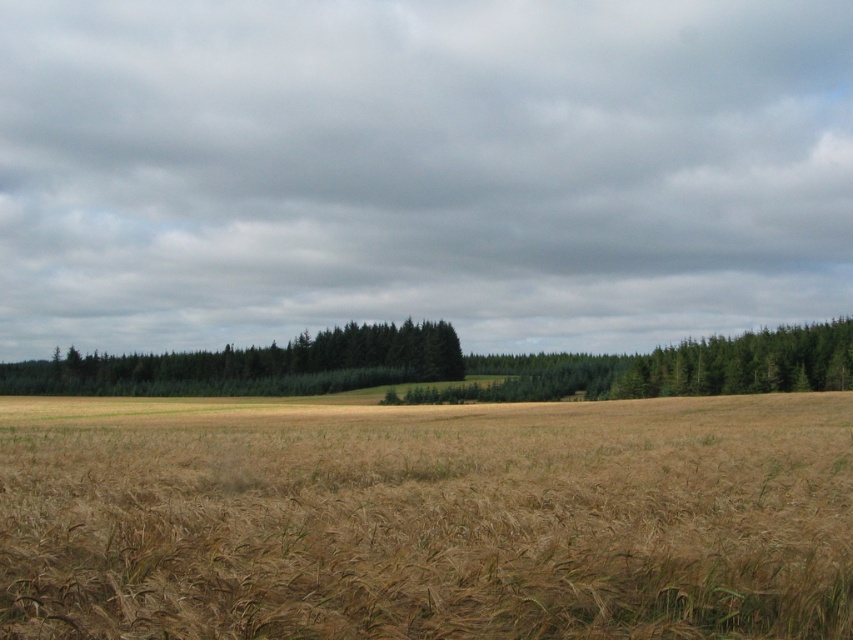
Question: Which point appears closest to the camera in this image?

Choices:
 (A) (572, 499)
 (B) (165, 372)

Answer: (A)

Question: Which object is farther from the camera taking this photo?

Choices:
 (A) brown grassy field at center
 (B) green textured trees at center

Answer: (B)

Question: Does brown grassy field at center have a greater width compared to green textured trees at center?

Choices:
 (A) no
 (B) yes

Answer: (A)

Question: Is brown grassy field at center bigger than green textured trees at center?

Choices:
 (A) no
 (B) yes

Answer: (A)

Question: In this image, where is brown grassy field at center located relative to green textured trees at center?

Choices:
 (A) left
 (B) right

Answer: (B)